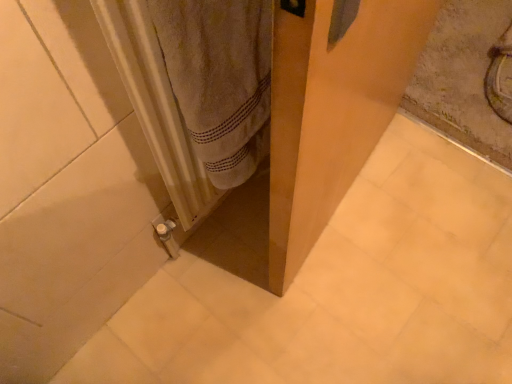
Question: Does transparent plastic screen door at center have a smaller size compared to white textured radiator at lower left?

Choices:
 (A) no
 (B) yes

Answer: (A)

Question: From a real-world perspective, is transparent plastic screen door at center physically above white textured radiator at lower left?

Choices:
 (A) no
 (B) yes

Answer: (A)

Question: From the image's perspective, is transparent plastic screen door at center on top of white textured radiator at lower left?

Choices:
 (A) no
 (B) yes

Answer: (B)

Question: Are transparent plastic screen door at center and white textured radiator at lower left making contact?

Choices:
 (A) no
 (B) yes

Answer: (A)

Question: Does transparent plastic screen door at center have a lesser height compared to white textured radiator at lower left?

Choices:
 (A) yes
 (B) no

Answer: (B)

Question: Is the depth of transparent plastic screen door at center greater than that of white textured radiator at lower left?

Choices:
 (A) yes
 (B) no

Answer: (B)

Question: Is white textured radiator at lower left positioned far away from transparent plastic screen door at center?

Choices:
 (A) yes
 (B) no

Answer: (B)

Question: Can you confirm if white textured radiator at lower left is bigger than transparent plastic screen door at center?

Choices:
 (A) yes
 (B) no

Answer: (B)

Question: Can you confirm if white textured radiator at lower left is positioned to the right of transparent plastic screen door at center?

Choices:
 (A) yes
 (B) no

Answer: (B)

Question: Does white textured radiator at lower left have a greater height compared to transparent plastic screen door at center?

Choices:
 (A) no
 (B) yes

Answer: (A)

Question: Does white textured radiator at lower left come behind transparent plastic screen door at center?

Choices:
 (A) no
 (B) yes

Answer: (B)

Question: Does white textured radiator at lower left have a lesser height compared to transparent plastic screen door at center?

Choices:
 (A) no
 (B) yes

Answer: (B)

Question: From a real-world perspective, is transparent plastic screen door at center positioned above or below white textured radiator at lower left?

Choices:
 (A) above
 (B) below

Answer: (B)